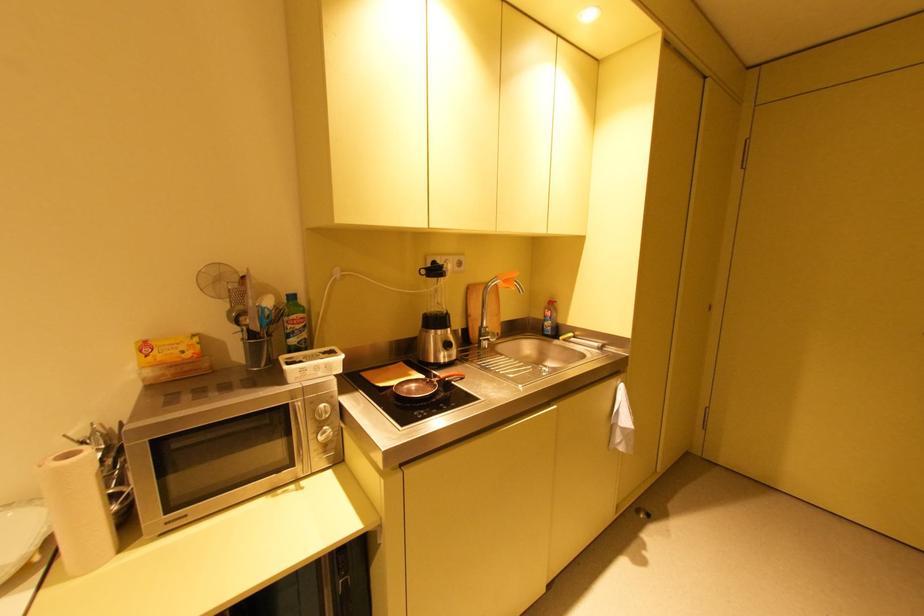
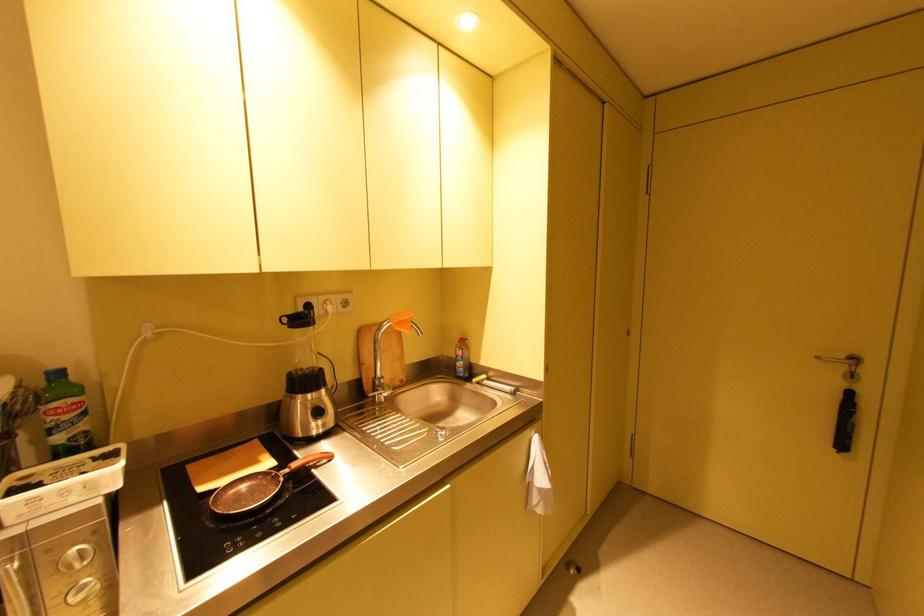
The point at (508, 282) is marked in the first image. Where is the corresponding point in the second image?

(400, 325)